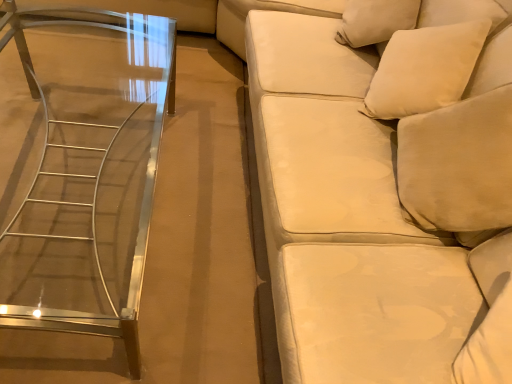
Question: Can you confirm if clear glass table at left is wider than white soft pillow at upper right?

Choices:
 (A) yes
 (B) no

Answer: (A)

Question: From the image's perspective, is clear glass table at left above white soft pillow at upper right?

Choices:
 (A) yes
 (B) no

Answer: (B)

Question: From the image's perspective, is clear glass table at left located beneath white soft pillow at upper right?

Choices:
 (A) yes
 (B) no

Answer: (A)

Question: Does clear glass table at left have a larger size compared to white soft pillow at upper right?

Choices:
 (A) no
 (B) yes

Answer: (B)

Question: Considering the relative positions of clear glass table at left and white soft pillow at upper right in the image provided, is clear glass table at left behind white soft pillow at upper right?

Choices:
 (A) yes
 (B) no

Answer: (B)

Question: From a real-world perspective, is clear glass table at left above or below white soft pillow at upper right?

Choices:
 (A) above
 (B) below

Answer: (B)

Question: Does point 112,243 appear closer or farther from the camera than point 451,44?

Choices:
 (A) closer
 (B) farther

Answer: (B)

Question: Considering the positions of clear glass table at left and white soft pillow at upper right in the image, is clear glass table at left bigger or smaller than white soft pillow at upper right?

Choices:
 (A) small
 (B) big

Answer: (B)

Question: Considering the positions of clear glass table at left and white soft pillow at upper right in the image, is clear glass table at left taller or shorter than white soft pillow at upper right?

Choices:
 (A) tall
 (B) short

Answer: (A)

Question: Is point (168, 102) positioned closer to the camera than point (409, 263)?

Choices:
 (A) farther
 (B) closer

Answer: (A)

Question: Is clear glass table at left in front of or behind velvet beige studio couch at right in the image?

Choices:
 (A) behind
 (B) front

Answer: (A)

Question: From the image's perspective, is clear glass table at left above or below velvet beige studio couch at right?

Choices:
 (A) below
 (B) above

Answer: (A)

Question: Is clear glass table at left taller or shorter than velvet beige studio couch at right?

Choices:
 (A) short
 (B) tall

Answer: (A)

Question: Choose the correct answer: Is white soft pillow at upper right inside clear glass table at left or outside it?

Choices:
 (A) outside
 (B) inside

Answer: (A)

Question: Visually, is white soft pillow at upper right positioned to the left or to the right of clear glass table at left?

Choices:
 (A) left
 (B) right

Answer: (B)